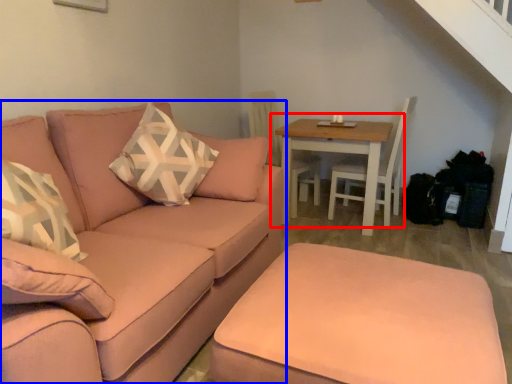
Question: Which of the following is the farthest to the observer, table (highlighted by a red box) or studio couch (highlighted by a blue box)?

Choices:
 (A) table
 (B) studio couch

Answer: (A)